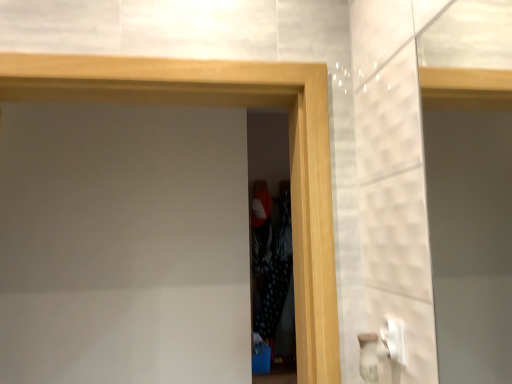
Question: From the image's perspective, would you say black dotted fabric at center, acting as the 1th screen door starting from the back, is shown under wooden frame at center, the second screen door viewed from the back?

Choices:
 (A) no
 (B) yes

Answer: (B)

Question: From a real-world perspective, is black dotted fabric at center, the second screen door viewed from the front, on top of wooden frame at center, the second screen door viewed from the back?

Choices:
 (A) no
 (B) yes

Answer: (A)

Question: Can you confirm if black dotted fabric at center, the second screen door viewed from the front, is bigger than wooden frame at center, the second screen door viewed from the back?

Choices:
 (A) no
 (B) yes

Answer: (A)

Question: Is black dotted fabric at center, the second screen door viewed from the front, with wooden frame at center, marked as the first screen door in a front-to-back arrangement?

Choices:
 (A) yes
 (B) no

Answer: (B)

Question: Is black dotted fabric at center, acting as the 1th screen door starting from the back, wider than wooden frame at center, marked as the first screen door in a front-to-back arrangement?

Choices:
 (A) no
 (B) yes

Answer: (A)

Question: Considering the relative positions of black dotted fabric at center, acting as the 1th screen door starting from the back, and wooden frame at center, marked as the first screen door in a front-to-back arrangement, in the image provided, is black dotted fabric at center, acting as the 1th screen door starting from the back, to the right of wooden frame at center, marked as the first screen door in a front-to-back arrangement, from the viewer's perspective?

Choices:
 (A) yes
 (B) no

Answer: (A)

Question: Does wooden frame at center, the second screen door viewed from the back, lie behind black dotted fabric at center, acting as the 1th screen door starting from the back?

Choices:
 (A) yes
 (B) no

Answer: (B)

Question: Is wooden frame at center, marked as the first screen door in a front-to-back arrangement, smaller than black dotted fabric at center, acting as the 1th screen door starting from the back?

Choices:
 (A) no
 (B) yes

Answer: (A)

Question: From a real-world perspective, does wooden frame at center, the second screen door viewed from the back, stand above black dotted fabric at center, the second screen door viewed from the front?

Choices:
 (A) no
 (B) yes

Answer: (B)

Question: Can you confirm if wooden frame at center, the second screen door viewed from the back, is positioned to the left of black dotted fabric at center, acting as the 1th screen door starting from the back?

Choices:
 (A) no
 (B) yes

Answer: (B)

Question: Does wooden frame at center, marked as the first screen door in a front-to-back arrangement, have a larger size compared to black dotted fabric at center, acting as the 1th screen door starting from the back?

Choices:
 (A) no
 (B) yes

Answer: (B)

Question: Can black dotted fabric at center, acting as the 1th screen door starting from the back, be found inside wooden frame at center, marked as the first screen door in a front-to-back arrangement?

Choices:
 (A) no
 (B) yes

Answer: (A)

Question: Is black dotted fabric at center, the second screen door viewed from the front, spatially inside wooden frame at center, marked as the first screen door in a front-to-back arrangement, or outside of it?

Choices:
 (A) outside
 (B) inside

Answer: (A)